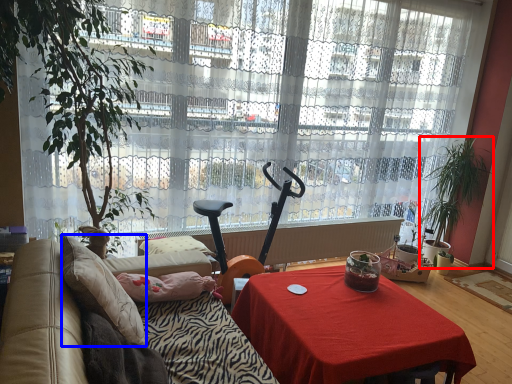
Question: Which object appears closest to the camera in this image, houseplant (highlighted by a red box) or pillow (highlighted by a blue box)?

Choices:
 (A) houseplant
 (B) pillow

Answer: (B)